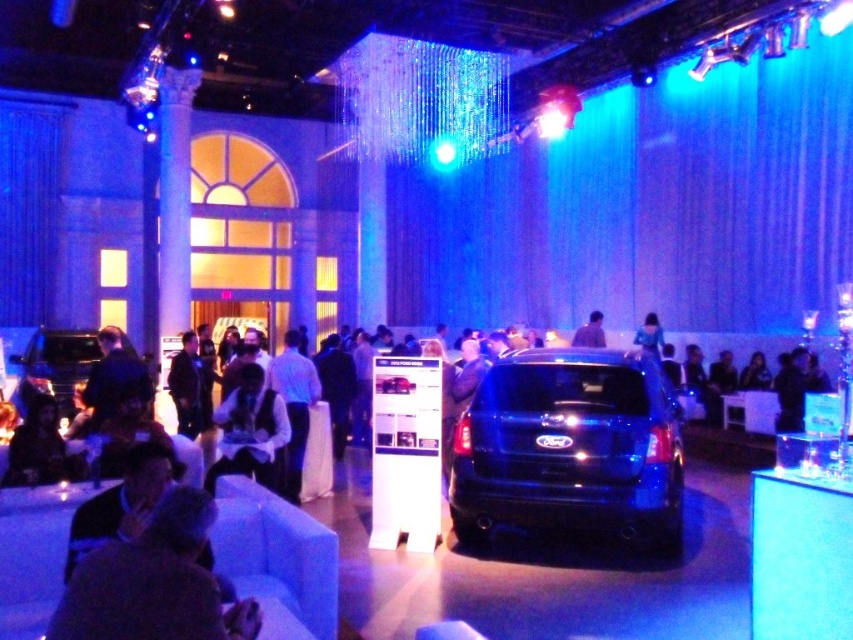
Question: Which object is farther from the camera taking this photo?

Choices:
 (A) white satin vest at center
 (B) shiny black suv at left
 (C) dark brown leather jacket at lower left
 (D) matte black car at center

Answer: (D)

Question: Does shiny black suv at left have a larger size compared to blue fabric shirt at center?

Choices:
 (A) yes
 (B) no

Answer: (A)

Question: Does satin blue suv at center have a lesser width compared to blue fabric shirt at center?

Choices:
 (A) yes
 (B) no

Answer: (B)

Question: Which point appears farthest from the camera in this image?

Choices:
 (A) (99, 561)
 (B) (585, 333)
 (C) (253, 433)

Answer: (B)

Question: Does dark brown leather jacket at lower left have a greater width compared to matte black car at center?

Choices:
 (A) no
 (B) yes

Answer: (B)

Question: Which point is closer to the camera taking this photo?

Choices:
 (A) (225, 417)
 (B) (248, 637)

Answer: (B)